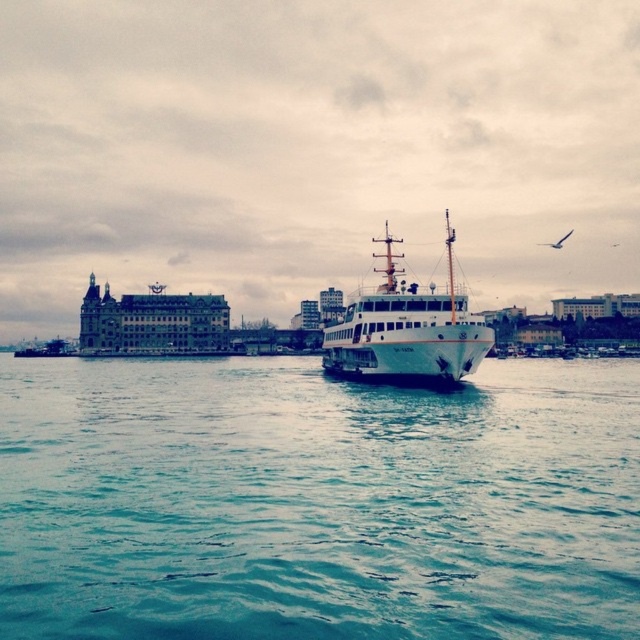
Does point (134, 560) come in front of point (381, 346)?

Yes, point (134, 560) is in front of point (381, 346).

Who is positioned more to the left, blue water at center or white matte ship at center?

blue water at center

What are the coordinates of `blue water at center` in the screenshot? It's located at (316, 500).